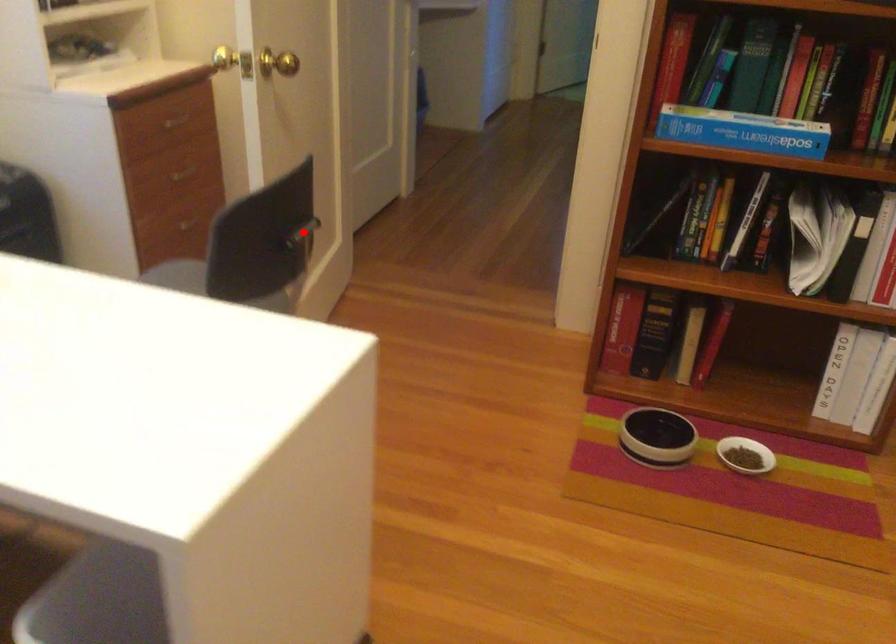
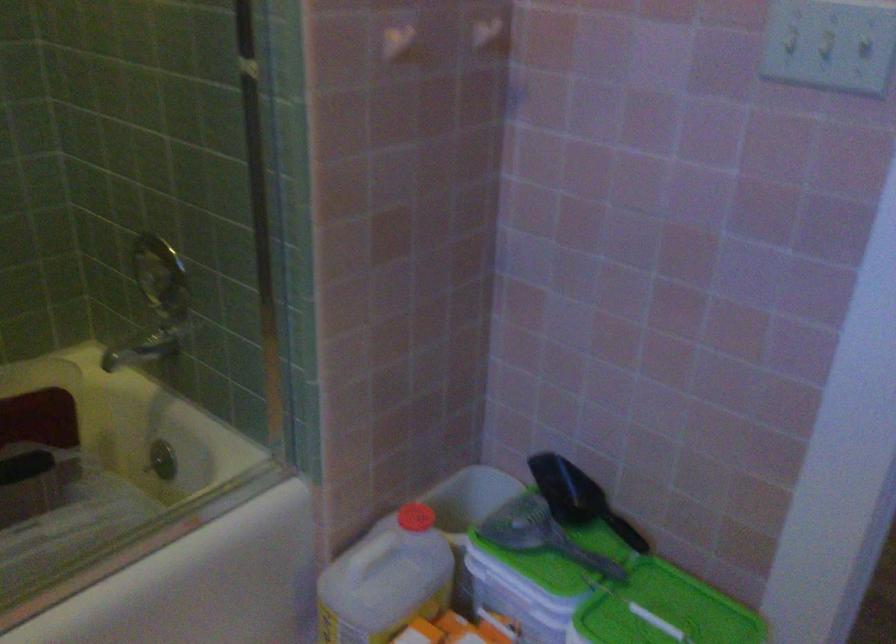
Question: I am providing you with two images of the same scene from different viewpoints. A red point is marked on the first image. Is the red point's position out of view in image 2?

Choices:
 (A) Yes
 (B) No

Answer: (A)